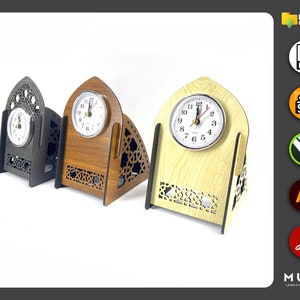
Where is `1 black clock`? This screenshot has height=300, width=300. 1 black clock is located at coordinates point(37,161).